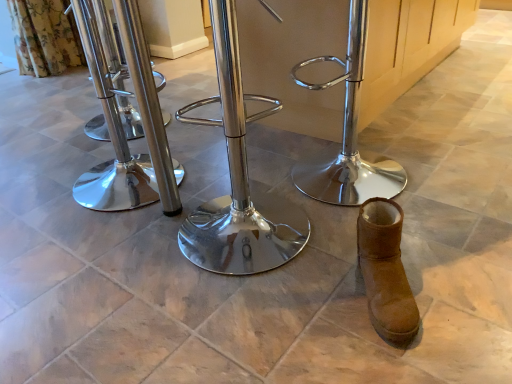
At what (x,y) coordinates should I click in order to perform the action: click on vacant area on the back side of polished metal swivel chair at center, marked as the first swivel chair in a left-to-right arrangement. Please return your answer as a coordinate pair (x, y). This screenshot has width=512, height=384. Looking at the image, I should click on (136, 141).